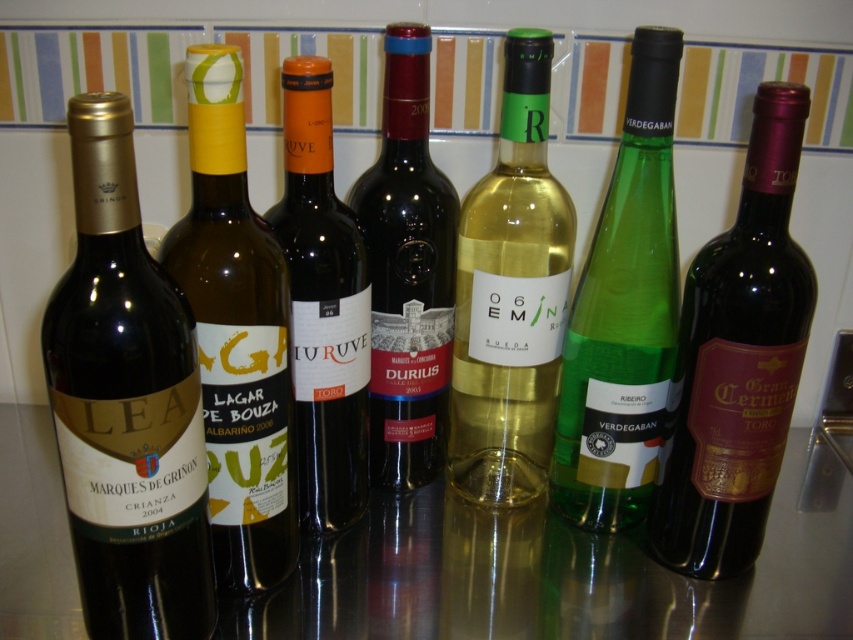
Question: Can you confirm if translucent glass wine bottle at center is thinner than orange matte bottle at center?

Choices:
 (A) no
 (B) yes

Answer: (A)

Question: Which point is closer to the camera?

Choices:
 (A) (190, 74)
 (B) (663, 529)

Answer: (A)

Question: Which point is closer to the camera?

Choices:
 (A) yellow matte wine bottle at center
 (B) translucent glass wine bottle at center
 (C) matte dark red wine at center

Answer: (A)

Question: In this image, where is shiny dark red wine at center located relative to yellow matte wine bottle at center?

Choices:
 (A) right
 (B) left

Answer: (A)

Question: Does matte gold wine bottle at left come behind yellow matte wine bottle at center?

Choices:
 (A) yes
 (B) no

Answer: (B)

Question: Which point is farther to the camera?

Choices:
 (A) (466, 282)
 (B) (234, 488)

Answer: (A)